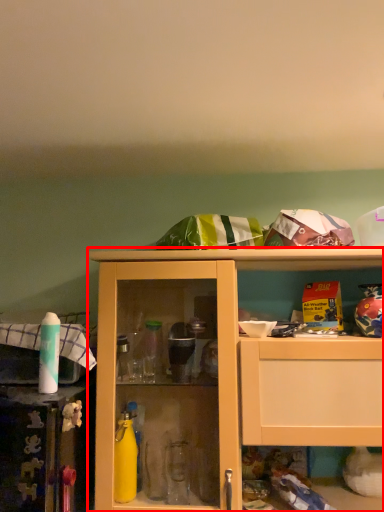
Question: Considering the relative positions of cabinetry (annotated by the red box) and bottle in the image provided, where is cabinetry (annotated by the red box) located with respect to the staircase?

Choices:
 (A) left
 (B) right

Answer: (B)